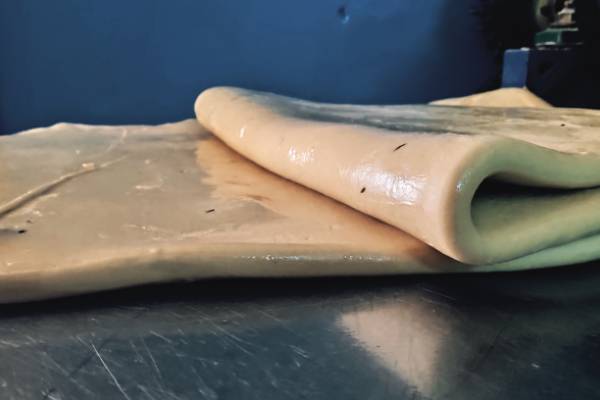
You are a GUI agent. You are given a task and a screenshot of the screen. Output one action in this format:
    pyautogui.click(x=<x>, y=<y>)
    Task: Click on the blue metal backsplash
    This screenshot has width=600, height=400.
    Given the screenshot: What is the action you would take?
    pyautogui.click(x=160, y=40)